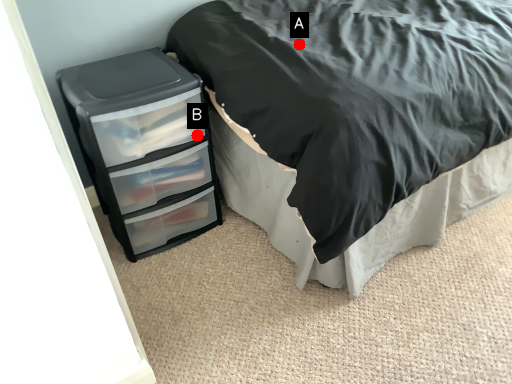
Question: Two points are circled on the image, labeled by A and B beside each circle. Which point is further to the camera?

Choices:
 (A) A is further
 (B) B is further

Answer: (B)